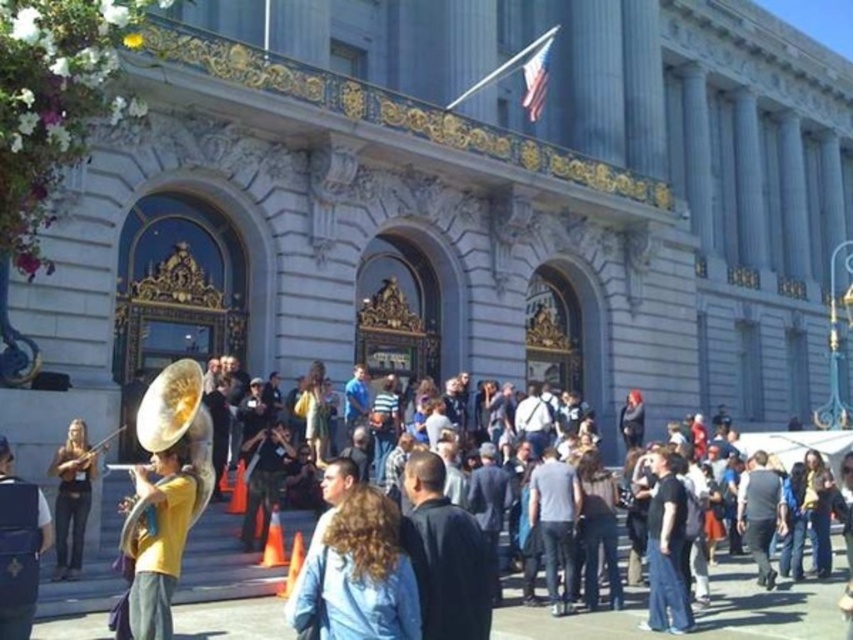
You are organizing a parade and need to arrange the gold metallic tuba at left and the matte brown violin at lower left in a line. Which instrument should be placed first if you want the larger object to come first?

The matte brown violin at lower left should be placed first because it occupies more space than the gold metallic tuba at left.

You are standing at the origin point of the coordinate system in the image. If you want to move towards the light blue denim jacket at center, in which direction should you go?

The light blue denim jacket at center is located at coordinate point [358,573]. Since the origin is at the bottom left corner of the image, moving towards this point would require going northeast.

You are organizing a photo shoot and need to ensure that the light blue denim jacket at center and the gold metallic tuba at left can both fit within a rectangular frame that is 1 meter wide. Based on their sizes, will both items fit side by side horizontally within this frame?

The light blue denim jacket at center is wider than the gold metallic tuba at left. However, without knowing the exact widths of both items, it is impossible to determine if their combined width exceeds 1 meter. Additional measurements are needed to confirm.